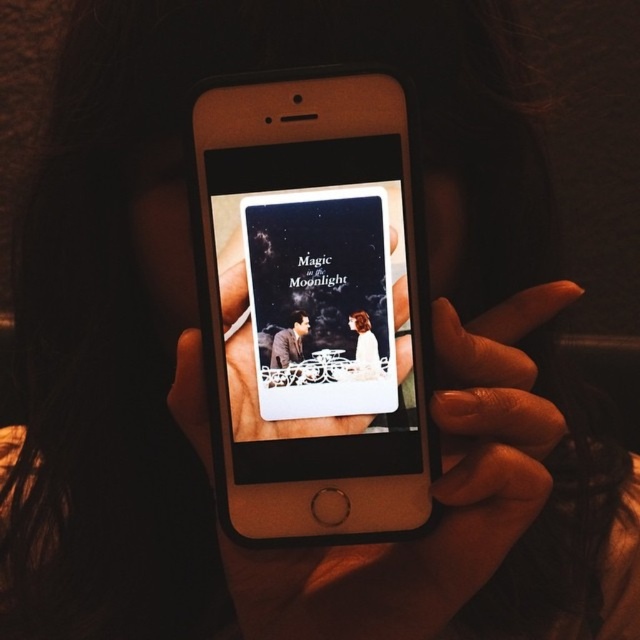
Image resolution: width=640 pixels, height=640 pixels. In order to click on gold metallic smartphone at center in this screenshot , I will do `click(314, 307)`.

Can you confirm if gold metallic smartphone at center is positioned to the right of smooth skin hand at center?

No, gold metallic smartphone at center is not to the right of smooth skin hand at center.

Is point (305, 84) less distant than point (273, 573)?

Yes, point (305, 84) is in front of point (273, 573).

Identify the location of gold metallic smartphone at center. (314, 307).

Can you confirm if smooth skin hand at center is thinner than matte plastic phone at center?

In fact, smooth skin hand at center might be wider than matte plastic phone at center.

Based on the photo, is smooth skin hand at center smaller than matte plastic phone at center?

No.

Is point (424, 598) behind point (310, 381)?

No, it is not.

Identify the location of smooth skin hand at center. (433, 496).

Does gold metallic smartphone at center lie behind matte plastic phone at center?

No, it is in front of matte plastic phone at center.

Measure the distance between gold metallic smartphone at center and matte plastic phone at center.

gold metallic smartphone at center is 0.63 inches away from matte plastic phone at center.

Does point (304, 276) lie in front of point (364, 360)?

That is False.

Image resolution: width=640 pixels, height=640 pixels. Find the location of `gold metallic smartphone at center`. gold metallic smartphone at center is located at coordinates (314, 307).